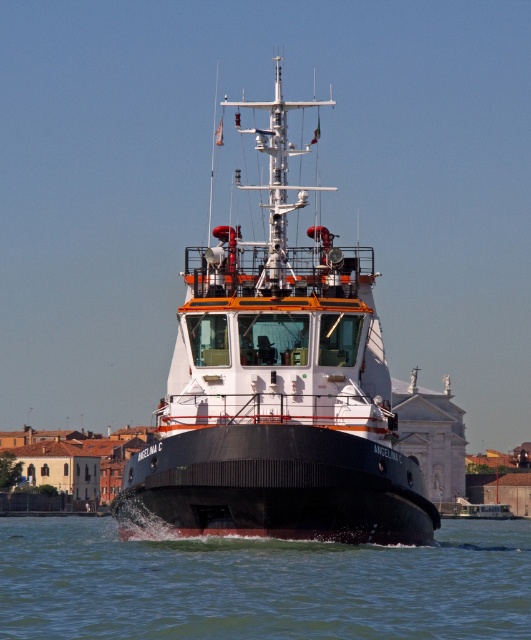
You are a passenger on the matte white ship at center and want to see the brown matte water at lower center. In which direction should you look relative to the ship?

The brown matte water at lower center is behind the matte white ship at center, so you should look behind the ship to see it.

You are a photographer trying to capture the matte white ship at center and the brown matte water at lower center in a single frame. Given that the ship is larger in the image, which object would you need to position closer to the camera to ensure both fill the frame appropriately?

The brown matte water at lower center is smaller in the image compared to the matte white ship at center. To balance their sizes in the frame, you should move closer to the brown matte water at lower center so it appears larger relative to the ship.